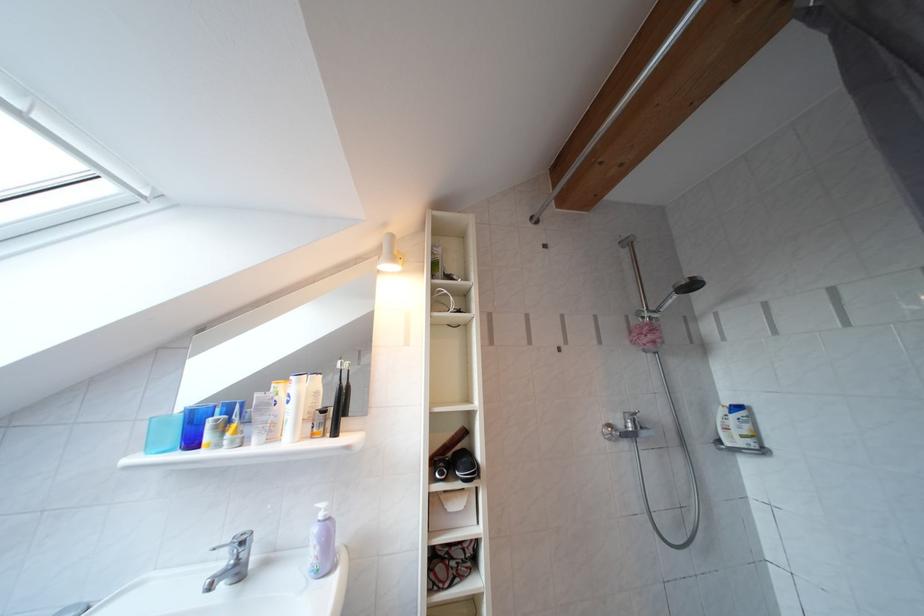
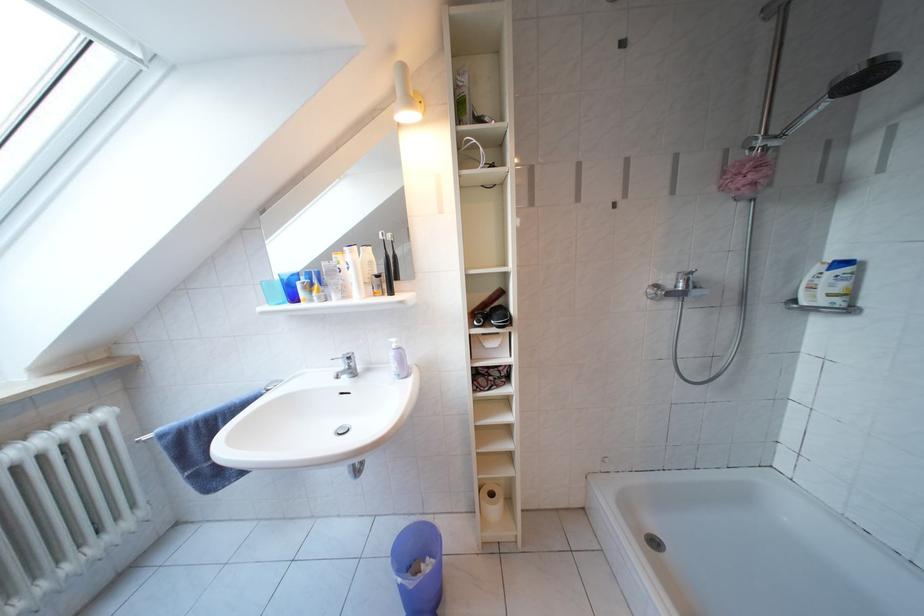
The point at (322,557) is marked in the first image. Where is the corresponding point in the second image?

(402, 371)